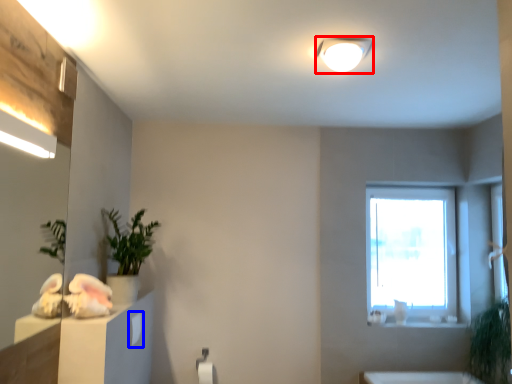
Question: Which of the following is the closest to the observer, light fixture (highlighted by a red box) or drawer (highlighted by a blue box)?

Choices:
 (A) light fixture
 (B) drawer

Answer: (A)